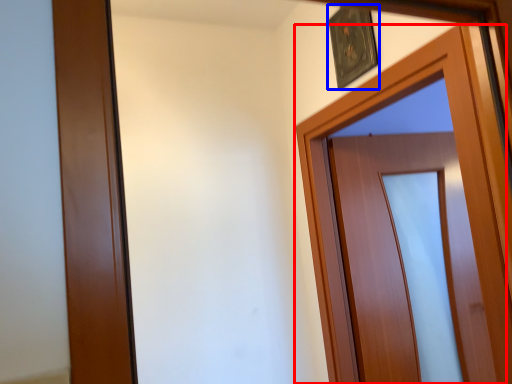
Question: Which object appears farthest to the camera in this image, door (highlighted by a red box) or picture frame (highlighted by a blue box)?

Choices:
 (A) door
 (B) picture frame

Answer: (B)